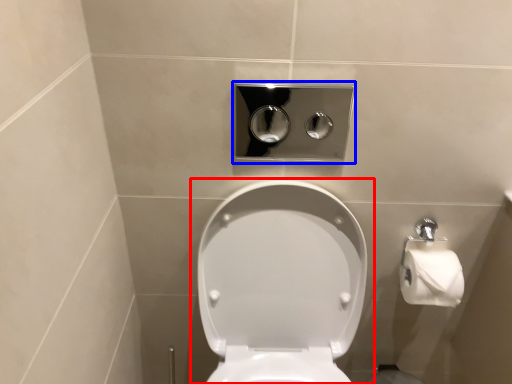
Question: Which of the following is the farthest to the observer, toilet (highlighted by a red box) or dispenser (highlighted by a blue box)?

Choices:
 (A) toilet
 (B) dispenser

Answer: (B)